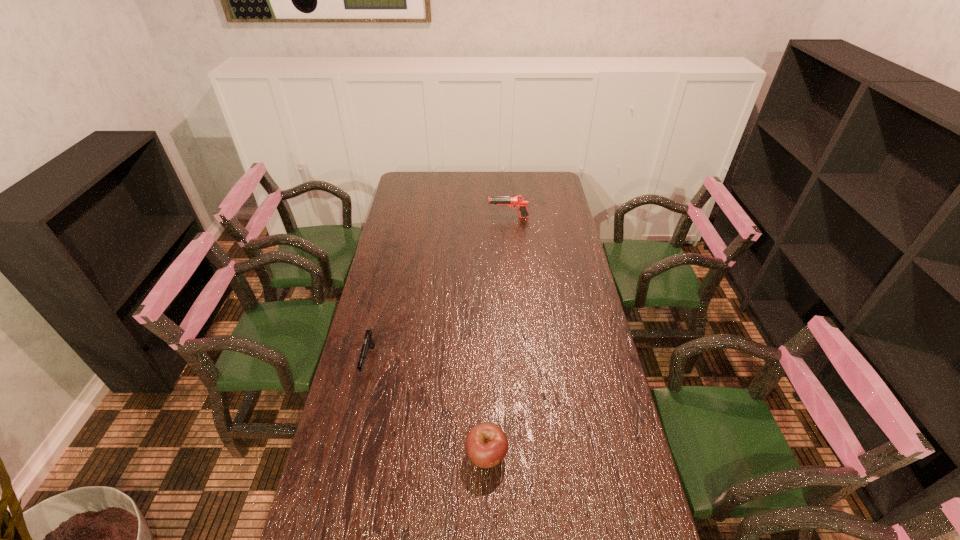
Identify the location of the farther gun. This screenshot has height=540, width=960. (518, 201).

Image resolution: width=960 pixels, height=540 pixels. I want to click on the right gun, so click(518, 201).

Find the location of a particular element. apple is located at coordinates (486, 445).

Locate an element on the screen. The height and width of the screenshot is (540, 960). the left gun is located at coordinates (368, 340).

Locate an element on the screen. This screenshot has width=960, height=540. the second farthest object is located at coordinates (368, 340).

Identify the location of vacant area situated at the aiming end of the right gun. The image size is (960, 540). (410, 217).

At what (x,y) coordinates should I click in order to perform the action: click on vacant region located at the aiming end of the right gun. Please return your answer as a coordinate pair (x, y). The width and height of the screenshot is (960, 540). Looking at the image, I should click on (436, 217).

Locate an element on the screen. free spot located 0.110m at the aiming end of the right gun is located at coordinates (465, 217).

You are a GUI agent. You are given a task and a screenshot of the screen. Output one action in this format:
    pyautogui.click(x=<x>, y=<y>)
    Task: Click on the free space located 0.140m on the side of the apple with the unique marking
    This screenshot has height=540, width=960.
    Given the screenshot: What is the action you would take?
    pyautogui.click(x=488, y=534)

Where is `free space located at the aiming end of the nearer gun`? Image resolution: width=960 pixels, height=540 pixels. free space located at the aiming end of the nearer gun is located at coordinates (351, 439).